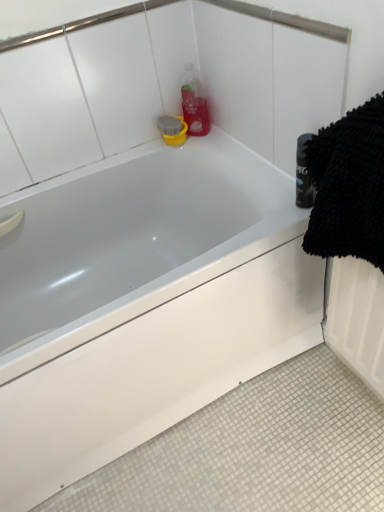
This screenshot has width=384, height=512. In order to click on vacant area that lies in front of translucent plastic bottle at upper center in this screenshot , I will do `click(215, 148)`.